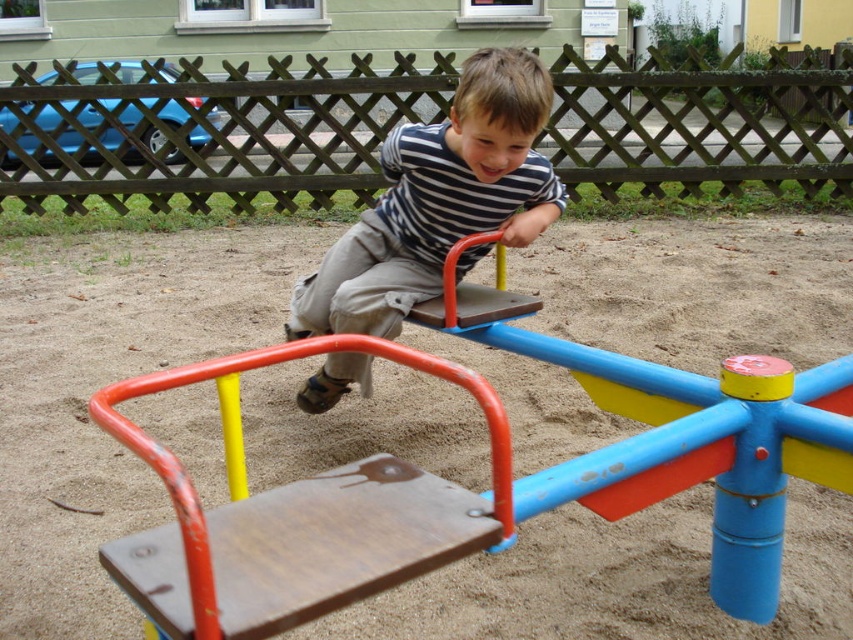
Question: Does brown wooden sand at center have a greater width compared to striped fabric shirt at center?

Choices:
 (A) no
 (B) yes

Answer: (B)

Question: Does brown wooden sand at center have a larger size compared to striped fabric shirt at center?

Choices:
 (A) no
 (B) yes

Answer: (B)

Question: Is brown wooden sand at center smaller than striped fabric shirt at center?

Choices:
 (A) yes
 (B) no

Answer: (B)

Question: Among these points, which one is farthest from the camera?

Choices:
 (A) (572, 564)
 (B) (320, 314)

Answer: (B)